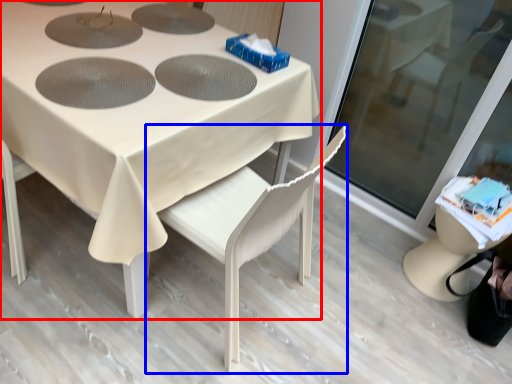
Question: Which object appears closest to the camera in this image, table (highlighted by a red box) or chair (highlighted by a blue box)?

Choices:
 (A) table
 (B) chair

Answer: (A)